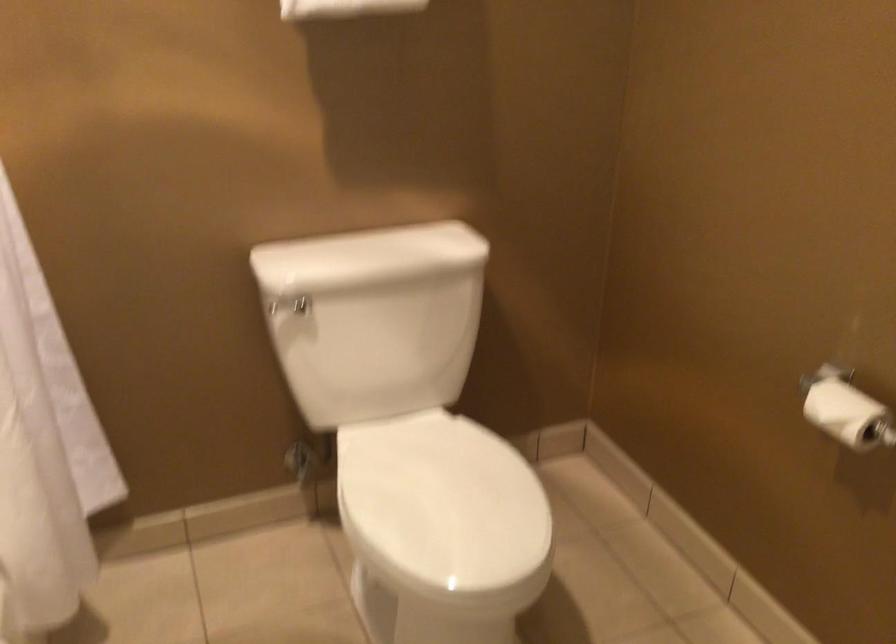
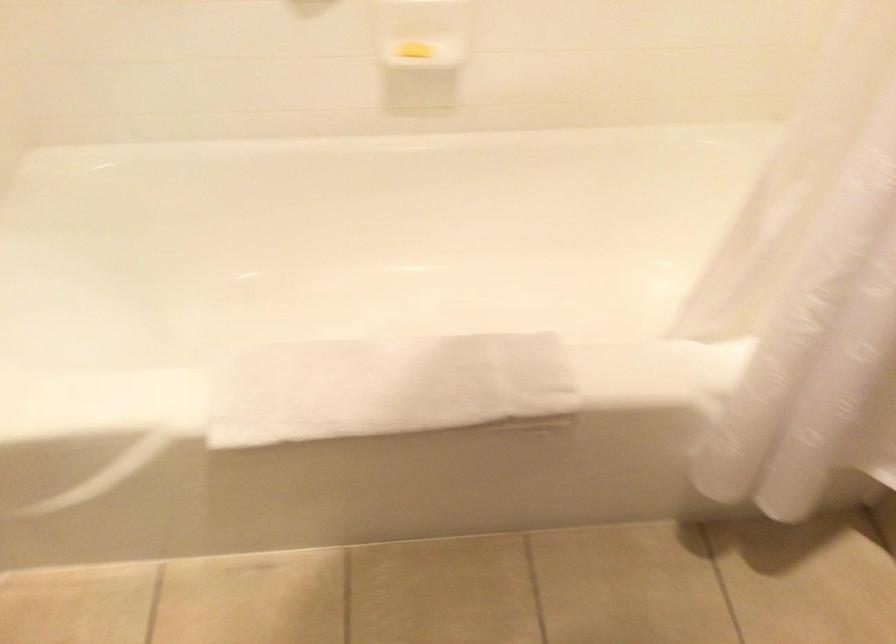
The images are taken continuously from a first-person perspective. In which direction is your viewpoint rotating?

The rotation direction of the camera is left-down.